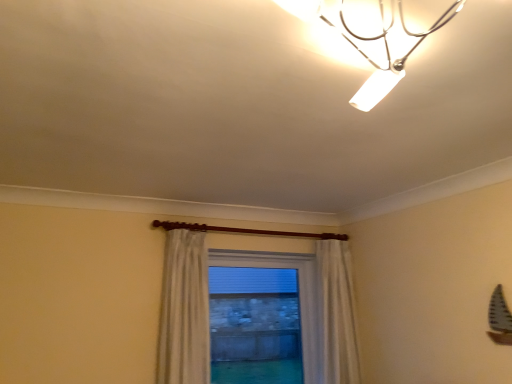
Question: Are clear glass window at center and metallic chrome lamp at upper center located far from each other?

Choices:
 (A) yes
 (B) no

Answer: (A)

Question: From the image's perspective, is clear glass window at center on metallic chrome lamp at upper center?

Choices:
 (A) yes
 (B) no

Answer: (B)

Question: Is clear glass window at center facing away from metallic chrome lamp at upper center?

Choices:
 (A) yes
 (B) no

Answer: (B)

Question: Considering the relative sizes of clear glass window at center and metallic chrome lamp at upper center in the image provided, is clear glass window at center wider than metallic chrome lamp at upper center?

Choices:
 (A) no
 (B) yes

Answer: (A)

Question: Is clear glass window at center next to metallic chrome lamp at upper center and touching it?

Choices:
 (A) no
 (B) yes

Answer: (A)

Question: Is clear glass window at center shorter than metallic chrome lamp at upper center?

Choices:
 (A) no
 (B) yes

Answer: (A)

Question: From the image's perspective, is metallic chrome lamp at upper center on top of white sheer curtain at center?

Choices:
 (A) yes
 (B) no

Answer: (A)

Question: Are metallic chrome lamp at upper center and white sheer curtain at center located far from each other?

Choices:
 (A) no
 (B) yes

Answer: (B)

Question: From a real-world perspective, is metallic chrome lamp at upper center physically above white sheer curtain at center?

Choices:
 (A) yes
 (B) no

Answer: (A)

Question: Is metallic chrome lamp at upper center with white sheer curtain at center?

Choices:
 (A) no
 (B) yes

Answer: (A)

Question: Considering the relative sizes of metallic chrome lamp at upper center and white sheer curtain at center in the image provided, is metallic chrome lamp at upper center taller than white sheer curtain at center?

Choices:
 (A) yes
 (B) no

Answer: (B)

Question: Would you say white sheer curtain at center is part of metallic chrome lamp at upper center's contents?

Choices:
 (A) yes
 (B) no

Answer: (B)

Question: Considering the relative sizes of white sheer curtain at center and metallic chrome lamp at upper center in the image provided, is white sheer curtain at center wider than metallic chrome lamp at upper center?

Choices:
 (A) yes
 (B) no

Answer: (B)